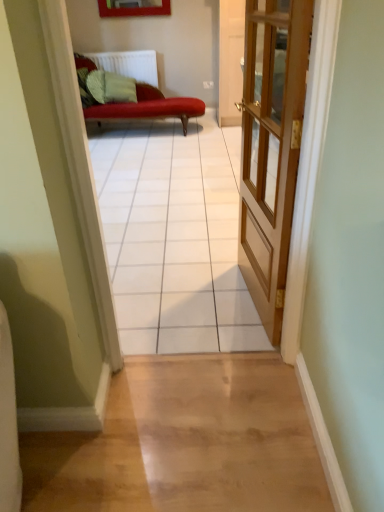
Question: Does white tile floor at center have a lesser height compared to wooden door at center?

Choices:
 (A) no
 (B) yes

Answer: (A)

Question: Is white tile floor at center bigger than wooden door at center?

Choices:
 (A) yes
 (B) no

Answer: (A)

Question: Can you confirm if white tile floor at center is smaller than wooden door at center?

Choices:
 (A) no
 (B) yes

Answer: (A)

Question: Does white tile floor at center appear on the left side of wooden door at center?

Choices:
 (A) yes
 (B) no

Answer: (A)

Question: Does white tile floor at center appear on the right side of wooden door at center?

Choices:
 (A) no
 (B) yes

Answer: (A)

Question: Are white tile floor at center and wooden door at center beside each other?

Choices:
 (A) yes
 (B) no

Answer: (B)

Question: Does white plastic radiator at upper center have a lesser width compared to wooden door at center?

Choices:
 (A) yes
 (B) no

Answer: (B)

Question: Is white plastic radiator at upper center facing towards wooden door at center?

Choices:
 (A) no
 (B) yes

Answer: (B)

Question: Is the surface of white plastic radiator at upper center in direct contact with wooden door at center?

Choices:
 (A) yes
 (B) no

Answer: (B)

Question: Is white plastic radiator at upper center wider than wooden door at center?

Choices:
 (A) yes
 (B) no

Answer: (A)

Question: From a real-world perspective, is white plastic radiator at upper center physically below wooden door at center?

Choices:
 (A) yes
 (B) no

Answer: (A)

Question: Is white plastic radiator at upper center taller than wooden door at center?

Choices:
 (A) no
 (B) yes

Answer: (A)

Question: Is there a large distance between white tile floor at center and white plastic radiator at upper center?

Choices:
 (A) yes
 (B) no

Answer: (A)